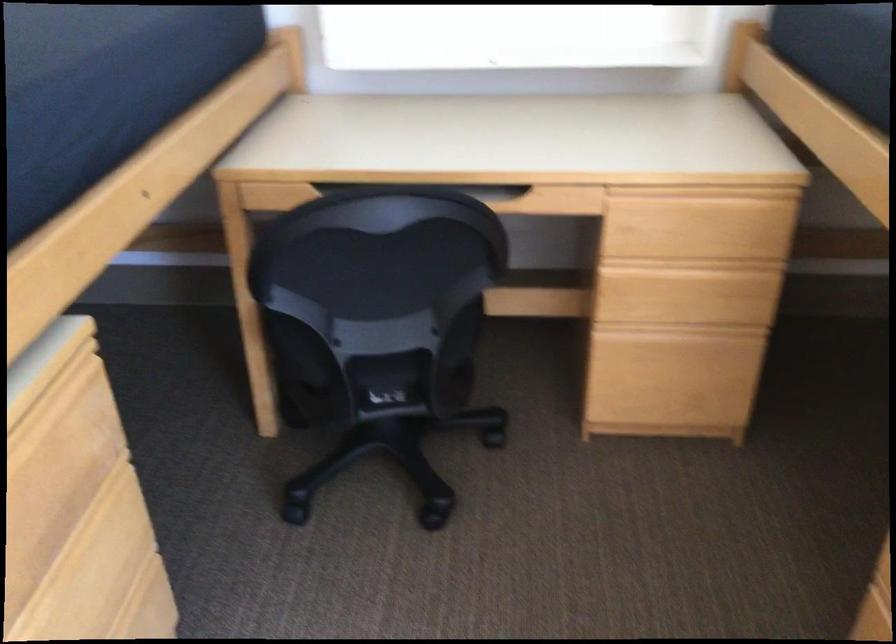
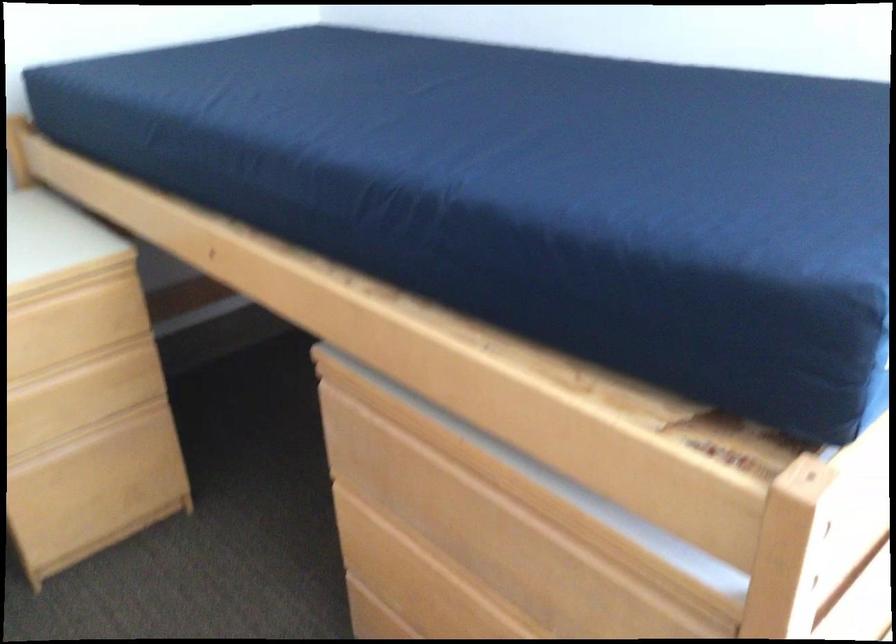
In the second image, find the point that corresponds to pixel 670 298 in the first image.

(65, 410)